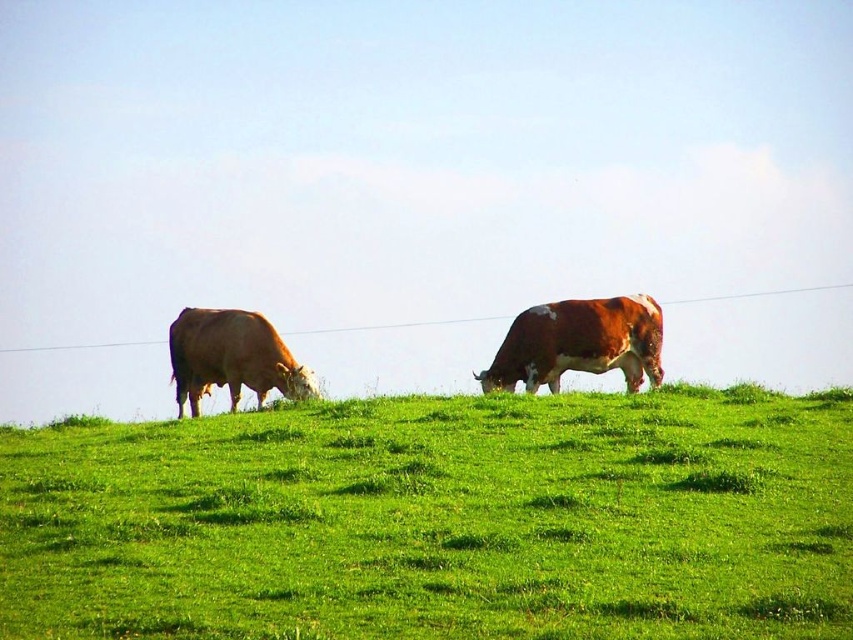
Question: Which is nearer to the brown smooth cow at left?

Choices:
 (A) green grassy hillside at center
 (B) brown speckled cow at center

Answer: (B)

Question: Which object is the closest to the brown speckled cow at center?

Choices:
 (A) brown smooth cow at left
 (B) green grassy hillside at center

Answer: (A)

Question: Can you confirm if green grassy hillside at center is bigger than brown speckled cow at center?

Choices:
 (A) no
 (B) yes

Answer: (B)

Question: Which of the following is the farthest from the observer?

Choices:
 (A) (734, 467)
 (B) (560, 369)

Answer: (B)

Question: Can you confirm if green grassy hillside at center is smaller than brown speckled cow at center?

Choices:
 (A) no
 (B) yes

Answer: (A)

Question: Does brown speckled cow at center have a greater width compared to brown smooth cow at left?

Choices:
 (A) yes
 (B) no

Answer: (A)